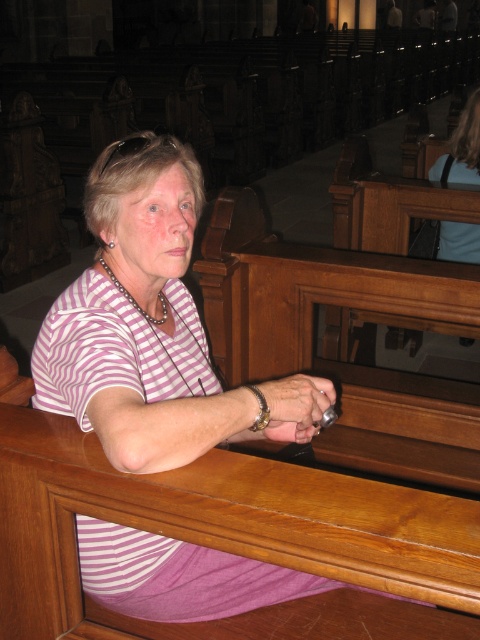
Which is in front, point (152, 570) or point (469, 180)?

Point (152, 570) is in front.

Based on the photo, can you confirm if pink striped shirt at center is wider than blue fabric shirt at upper center?

No.

Is point (223, 566) closer to camera compared to point (466, 120)?

Yes, it is.

You are a GUI agent. You are given a task and a screenshot of the screen. Output one action in this format:
    pyautogui.click(x=<x>, y=<y>)
    Task: Click on the pink striped shirt at center
    The width and height of the screenshot is (480, 640).
    Given the screenshot: What is the action you would take?
    pyautogui.click(x=139, y=320)

Does blue fabric shirt at upper center have a smaller size compared to gold textured bracelet at center?

Incorrect, blue fabric shirt at upper center is not smaller in size than gold textured bracelet at center.

Can you confirm if blue fabric shirt at upper center is positioned to the left of gold textured bracelet at center?

In fact, blue fabric shirt at upper center is to the right of gold textured bracelet at center.

Is point (441, 179) closer to viewer compared to point (260, 412)?

No, it is not.

Locate an element on the screen. This screenshot has height=640, width=480. blue fabric shirt at upper center is located at coordinates (462, 148).

Who is higher up, pink striped shirt at center or gold textured bracelet at center?

Positioned higher is pink striped shirt at center.

Is pink striped shirt at center positioned at the back of gold textured bracelet at center?

No, pink striped shirt at center is in front of gold textured bracelet at center.

Describe the element at coordinates (139, 320) in the screenshot. I see `pink striped shirt at center` at that location.

Find the location of a particular element. This screenshot has width=480, height=640. pink striped shirt at center is located at coordinates (139, 320).